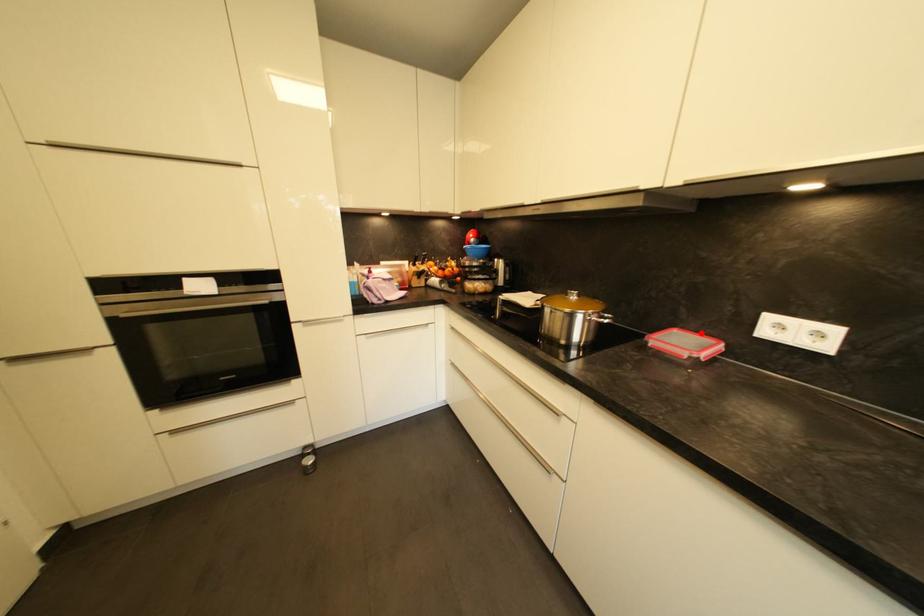
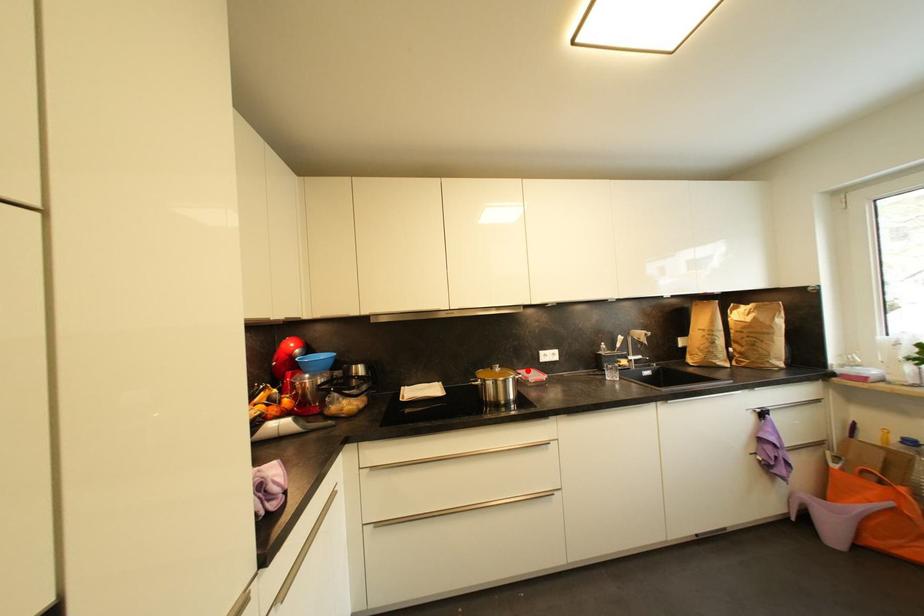
I am providing you with two images of the same scene from different viewpoints. A red point is marked on the first image and another point is marked on the second image. Do the highlighted points in image1 and image2 indicate the same real-world spot?

Yes